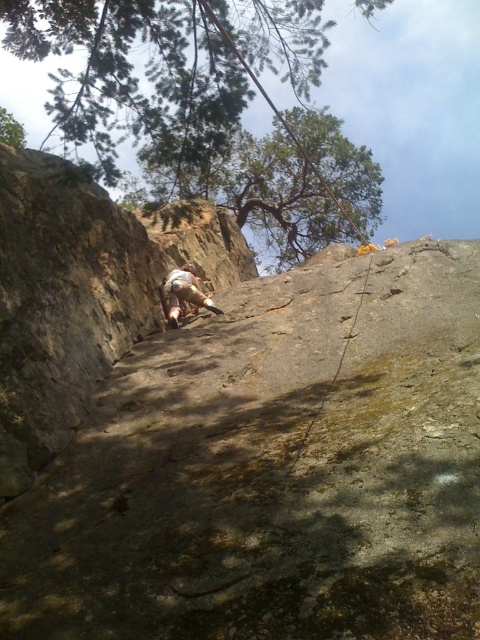
You are a photographer trying to capture the climber in the center while also including the tree in the background. Since the green leafy tree at upper left and the tan fabric pants at center are both in your viewfinder, which object should you adjust your focus on to ensure the climber is sharp and the tree remains in the background?

The green leafy tree at upper left is bigger than the tan fabric pants at center, so to keep the climber in focus and the tree as background, adjust focus on the tan fabric pants at center.